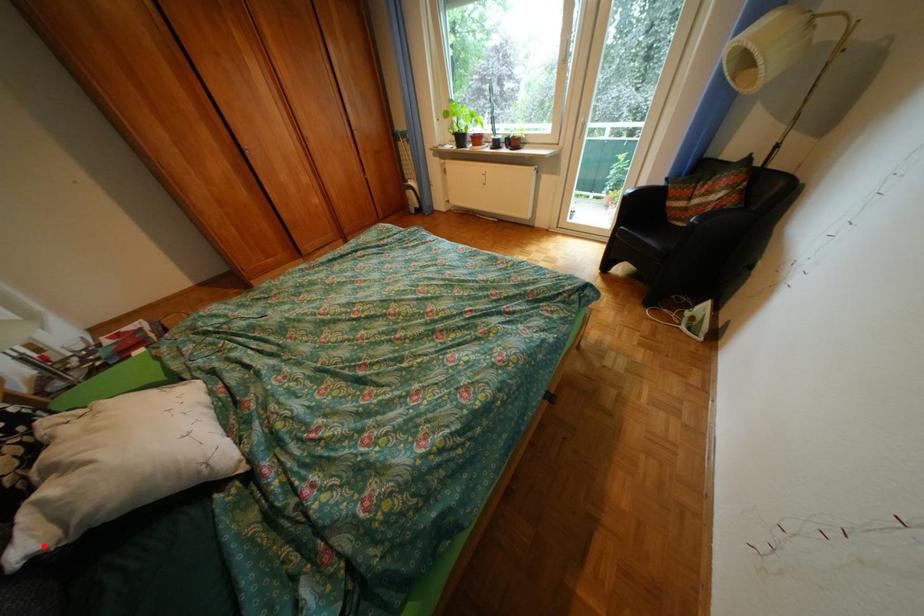
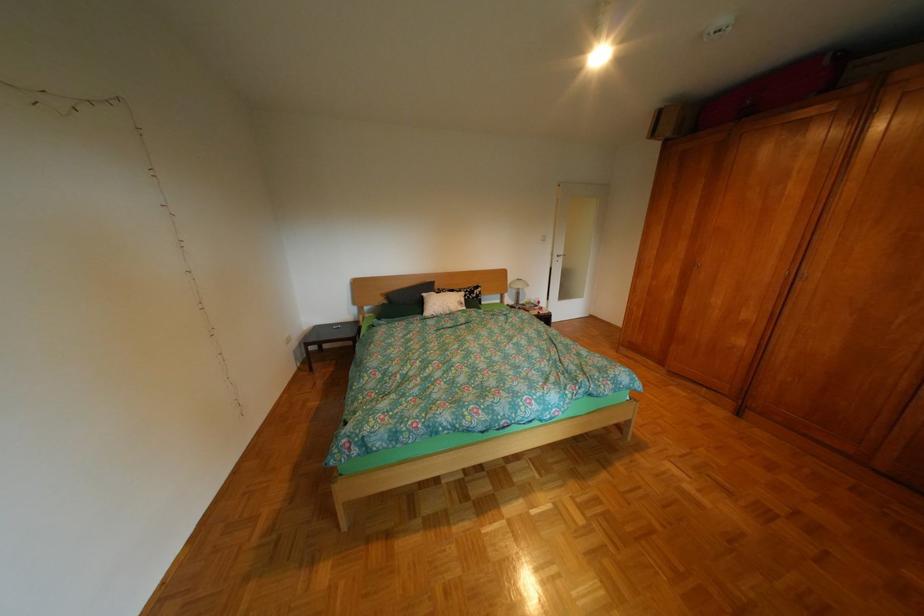
Where in the second image is the point corresponding to the highlighted location from the first image?

(439, 294)